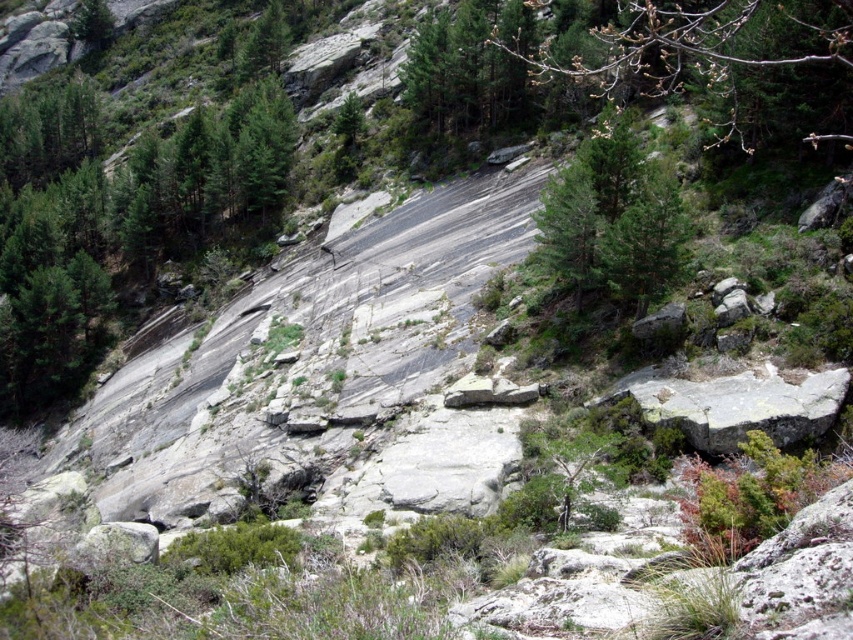
You are hiking through this rocky landscape and want to take a photo of both the bare branches at upper center and the green matte tree at center. Which object should you focus on first to ensure both are in sharp focus?

You should focus on the bare branches at upper center first because it is closer to the viewer than the green matte tree at center, so adjusting focus from near to far will help both be in focus.

You are a hiker planning to cross between the bare branches at upper center and the green matte tree at center. The trail between them is narrow. If your backpack is 1 meter wide, can you safely pass through the narrowest part of the trail?

The distance between the bare branches at upper center and the green matte tree at center is 9.22 meters. Since the backpack is only 1 meter wide, there is ample space to safely navigate the narrowest part of the trail between them.

You are a hiker standing at the bottom of the rocky slope and want to reach the highest point visible in the image. Which object, the bare branches at upper center or the green matte tree at center, should you aim for to reach the highest elevation?

The bare branches at upper center is much taller than the green matte tree at center, so you should aim for the bare branches at upper center to reach the highest elevation.